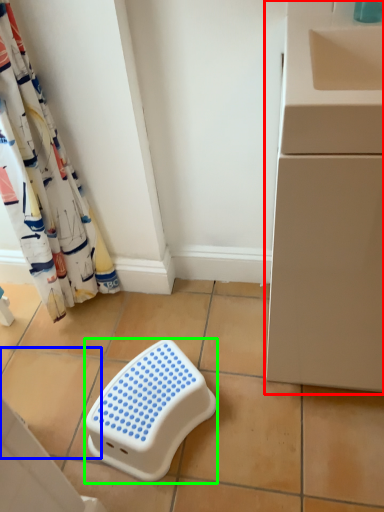
Question: Which is farther away from counter (highlighted by a red box)? ceramic tile (highlighted by a blue box) or furniture (highlighted by a green box)?

Choices:
 (A) ceramic tile
 (B) furniture

Answer: (A)